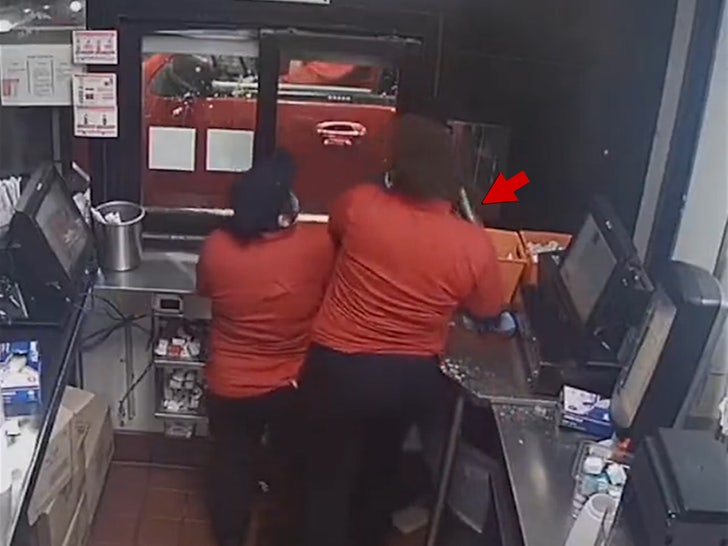
Find the location of a particular element. This screenshot has width=728, height=546. floor is located at coordinates (199, 507).